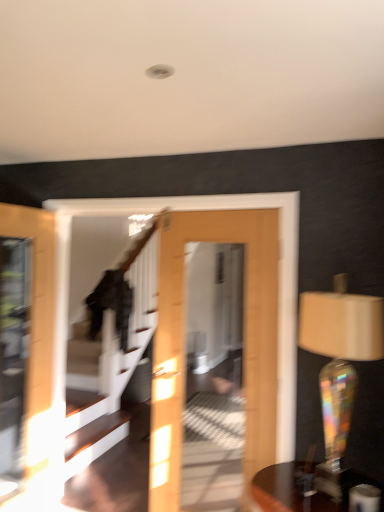
Question: From a real-world perspective, is iridescent glass table lamp at right on top of wooden round table at lower right?

Choices:
 (A) yes
 (B) no

Answer: (A)

Question: Considering the relative positions of iridescent glass table lamp at right and wooden round table at lower right in the image provided, is iridescent glass table lamp at right to the right of wooden round table at lower right from the viewer's perspective?

Choices:
 (A) yes
 (B) no

Answer: (A)

Question: Considering the relative sizes of iridescent glass table lamp at right and wooden round table at lower right in the image provided, is iridescent glass table lamp at right taller than wooden round table at lower right?

Choices:
 (A) yes
 (B) no

Answer: (A)

Question: Is iridescent glass table lamp at right at the left side of wooden round table at lower right?

Choices:
 (A) no
 (B) yes

Answer: (A)

Question: Is iridescent glass table lamp at right outside of wooden round table at lower right?

Choices:
 (A) no
 (B) yes

Answer: (B)

Question: From the image's perspective, is iridescent glass table lamp at right located above wooden round table at lower right?

Choices:
 (A) no
 (B) yes

Answer: (B)

Question: Considering the relative sizes of wooden round table at lower right and iridescent glass table lamp at right in the image provided, is wooden round table at lower right wider than iridescent glass table lamp at right?

Choices:
 (A) yes
 (B) no

Answer: (A)

Question: Is wooden round table at lower right at the right side of iridescent glass table lamp at right?

Choices:
 (A) no
 (B) yes

Answer: (A)

Question: Can iridescent glass table lamp at right be found inside wooden round table at lower right?

Choices:
 (A) no
 (B) yes

Answer: (A)

Question: Considering the relative positions of wooden round table at lower right and iridescent glass table lamp at right in the image provided, is wooden round table at lower right to the left of iridescent glass table lamp at right from the viewer's perspective?

Choices:
 (A) yes
 (B) no

Answer: (A)

Question: Can you confirm if wooden round table at lower right is smaller than iridescent glass table lamp at right?

Choices:
 (A) no
 (B) yes

Answer: (B)

Question: Is wooden round table at lower right not inside iridescent glass table lamp at right?

Choices:
 (A) no
 (B) yes

Answer: (B)

Question: Based on their sizes in the image, would you say iridescent glass table lamp at right is bigger or smaller than wooden round table at lower right?

Choices:
 (A) big
 (B) small

Answer: (A)